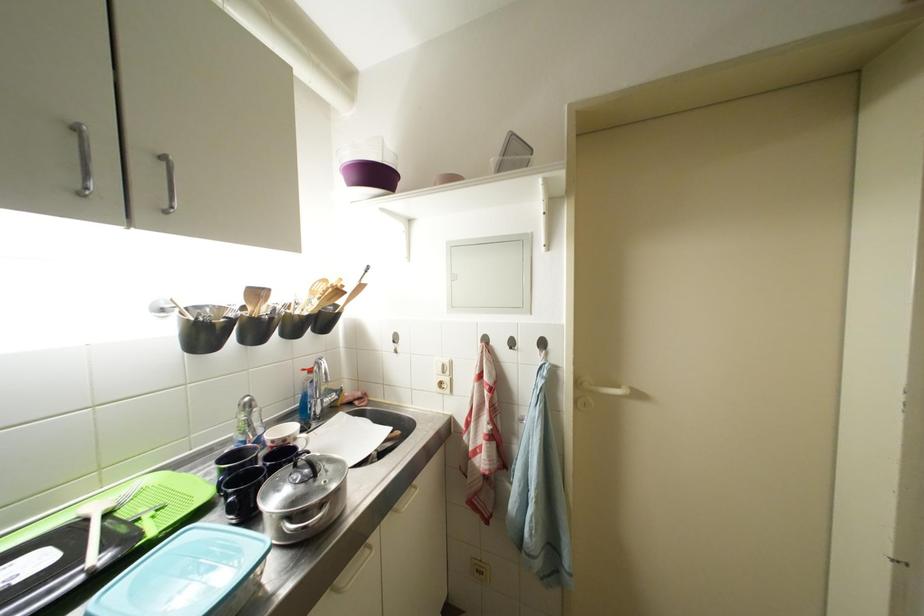
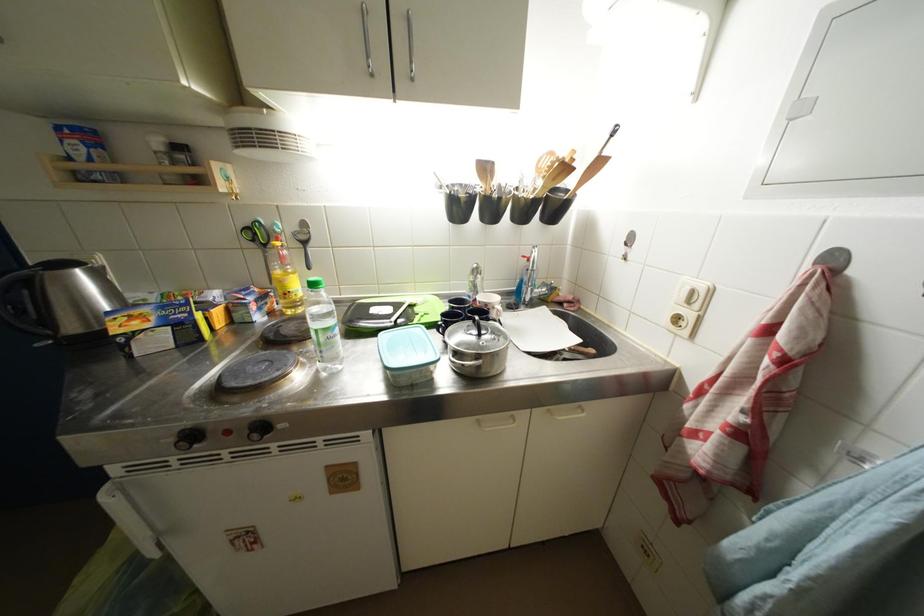
Find the pixel in the second image that matches [338,291] in the first image.

(565, 164)